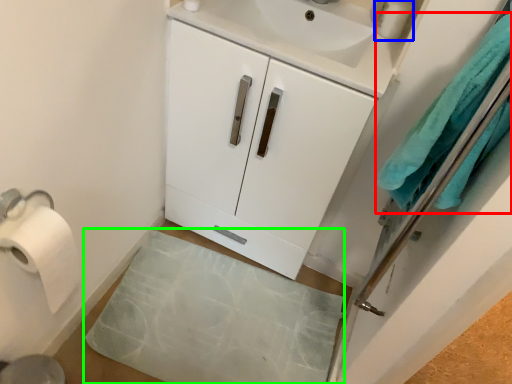
Question: Which object is the closest to the bath towel (highlighted by a red box)? Choose among these: toiletry (highlighted by a blue box) or bath mat (highlighted by a green box).

Choices:
 (A) toiletry
 (B) bath mat

Answer: (A)